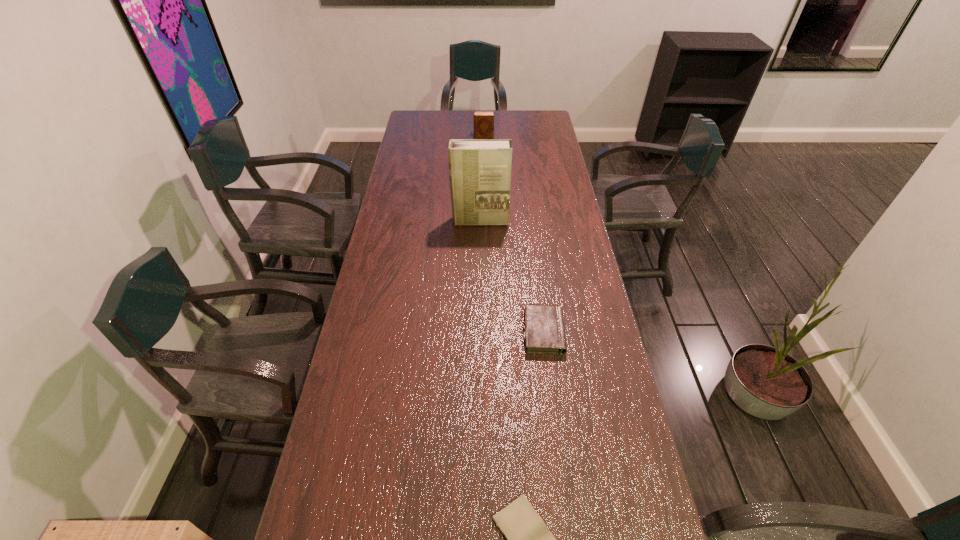
At what (x,y) coordinates should I click in order to perform the action: click on free point located 0.090m on the front of the second nearest object. Please return your answer as a coordinate pair (x, y). This screenshot has height=540, width=960. Looking at the image, I should click on (550, 382).

This screenshot has width=960, height=540. Identify the location of object positioned at the right edge. (544, 333).

Where is `vacant area at the far edge`? vacant area at the far edge is located at coordinates (497, 112).

This screenshot has height=540, width=960. I want to click on vacant space at the left edge of the desktop, so click(396, 161).

Image resolution: width=960 pixels, height=540 pixels. In order to click on free space at the right edge of the desktop in this screenshot , I will do `click(562, 151)`.

In the image, there is a desktop. Where is `vacant space at the far right corner`? The width and height of the screenshot is (960, 540). vacant space at the far right corner is located at coordinates (523, 121).

Identify the location of free space between the second tallest diary and the third nearest object. The height and width of the screenshot is (540, 960). (512, 276).

Identify the location of object that can be found as the second closest to the shortest object. (479, 169).

Select which object is the third closest to the third farthest object. Please provide its 2D coordinates. Your answer should be formatted as a tuple, i.e. [(x, y)], where the tuple contains the x and y coordinates of a point satisfying the conditions above.

[(483, 120)]

Find the location of a particular element. diary that stands as the second closest to the tallest diary is located at coordinates (527, 538).